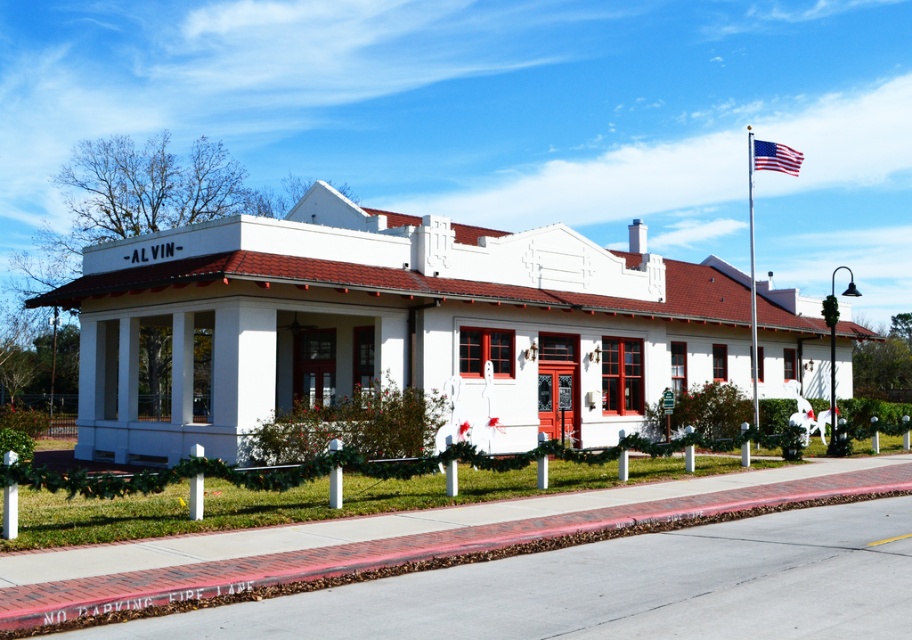
Question: Which point appears closest to the camera in this image?

Choices:
 (A) (764, 161)
 (B) (156, 596)
 (C) (750, 365)

Answer: (B)

Question: Among these points, which one is farthest from the camera?

Choices:
 (A) (752, 232)
 (B) (759, 161)
 (C) (810, 496)

Answer: (A)

Question: Is brick at lower center closer to camera compared to american flag at upper right?

Choices:
 (A) yes
 (B) no

Answer: (A)

Question: Can you confirm if metallic flag pole at center is bigger than american flag at upper right?

Choices:
 (A) no
 (B) yes

Answer: (B)

Question: Where is metallic flag pole at center located in relation to american flag at upper right in the image?

Choices:
 (A) right
 (B) left

Answer: (B)

Question: Which point is farther to the camera?

Choices:
 (A) (755, 342)
 (B) (778, 147)
 (C) (703, 508)

Answer: (A)